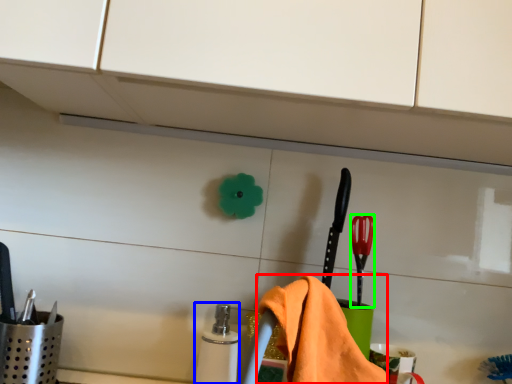
Question: Estimate the real-world distances between objects in this image. Which object is closer to bath towel (highlighted by a red box), toiletry (highlighted by a blue box) or brush (highlighted by a green box)?

Choices:
 (A) toiletry
 (B) brush

Answer: (B)